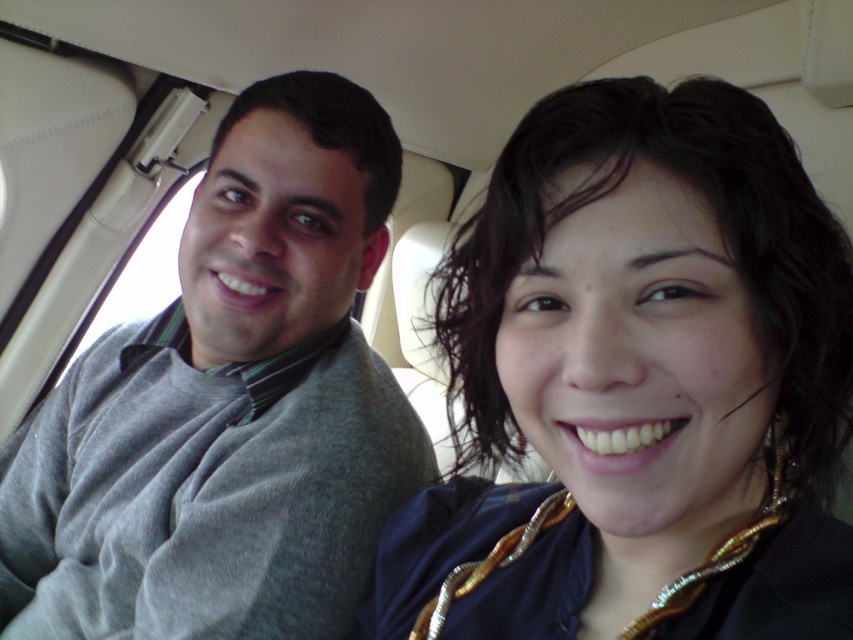
Question: Is dark blue fabric at center thinner than gray sweater at left?

Choices:
 (A) yes
 (B) no

Answer: (A)

Question: Which point appears farthest from the camera in this image?

Choices:
 (A) (697, 404)
 (B) (335, 129)

Answer: (B)

Question: Which of the following is the farthest from the observer?

Choices:
 (A) (320, 618)
 (B) (839, 300)

Answer: (A)

Question: Considering the relative positions of dark blue fabric at center and gray sweater at left in the image provided, where is dark blue fabric at center located with respect to gray sweater at left?

Choices:
 (A) right
 (B) left

Answer: (A)

Question: Does dark blue fabric at center have a lesser width compared to gray sweater at left?

Choices:
 (A) yes
 (B) no

Answer: (A)

Question: Which object appears farthest from the camera in this image?

Choices:
 (A) gray sweater at left
 (B) dark blue fabric at center

Answer: (A)